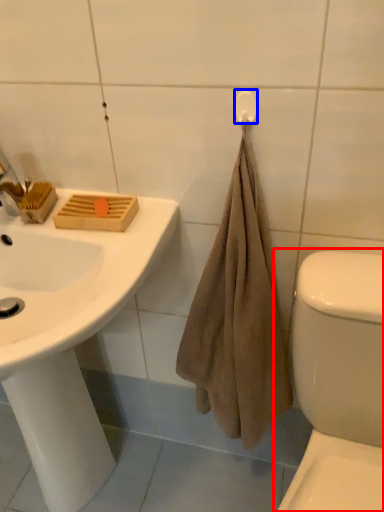
Question: Which object appears farthest to the camera in this image, toilet (highlighted by a red box) or towel bar (highlighted by a blue box)?

Choices:
 (A) toilet
 (B) towel bar

Answer: (B)